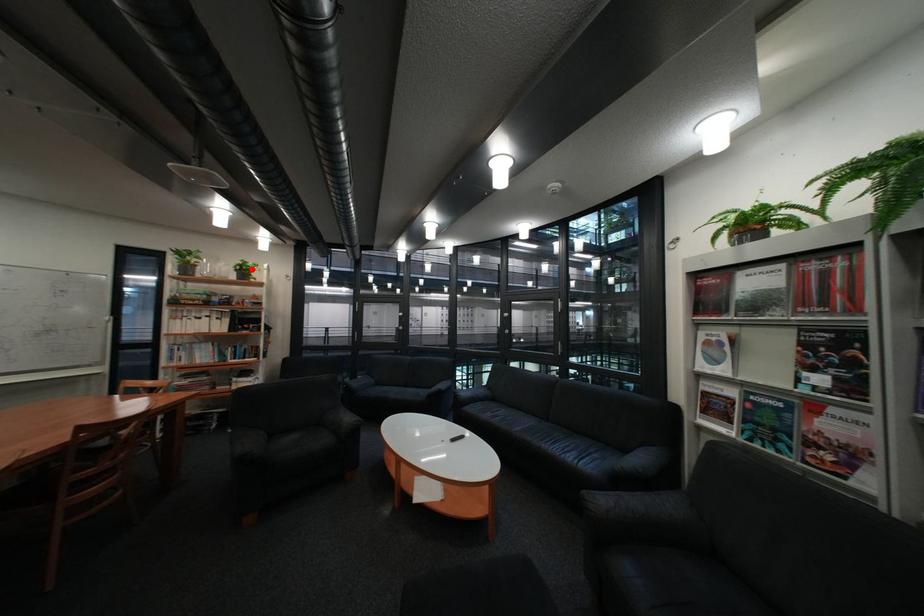
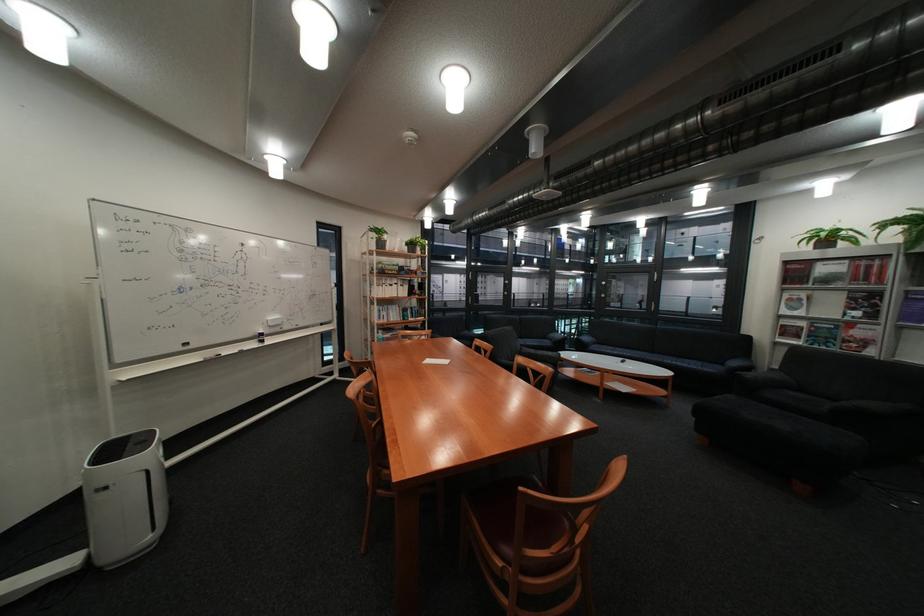
The point at the highlighted location is marked in the first image. Where is the corresponding point in the second image?

(421, 245)